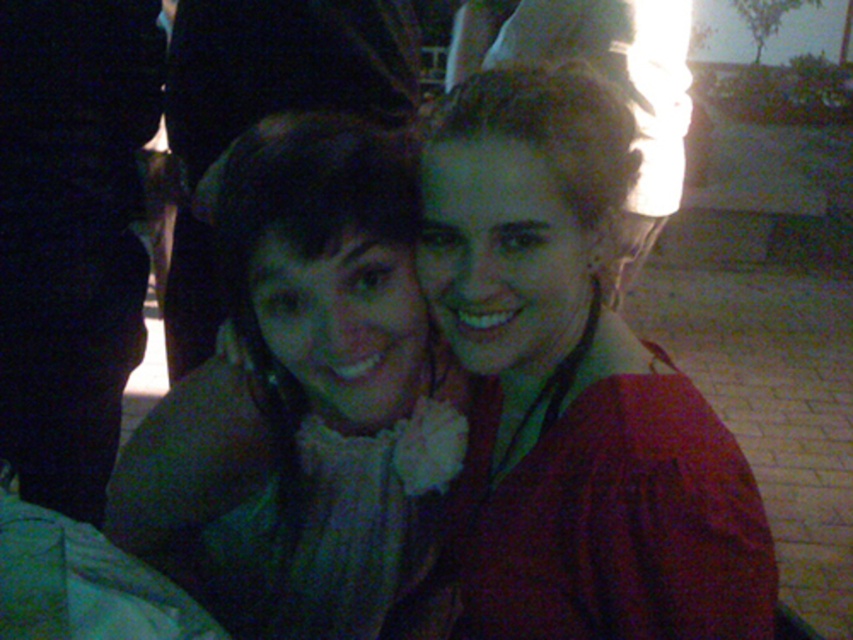
Between matte red sweater at center and green fabric scarf at center, which one is positioned lower?

green fabric scarf at center is below.

Is matte red sweater at center to the right of green fabric scarf at center from the viewer's perspective?

Correct, you'll find matte red sweater at center to the right of green fabric scarf at center.

Between point (556, 230) and point (350, 282), which one is positioned in front?

Point (556, 230) is in front.

I want to click on matte red sweater at center, so click(575, 387).